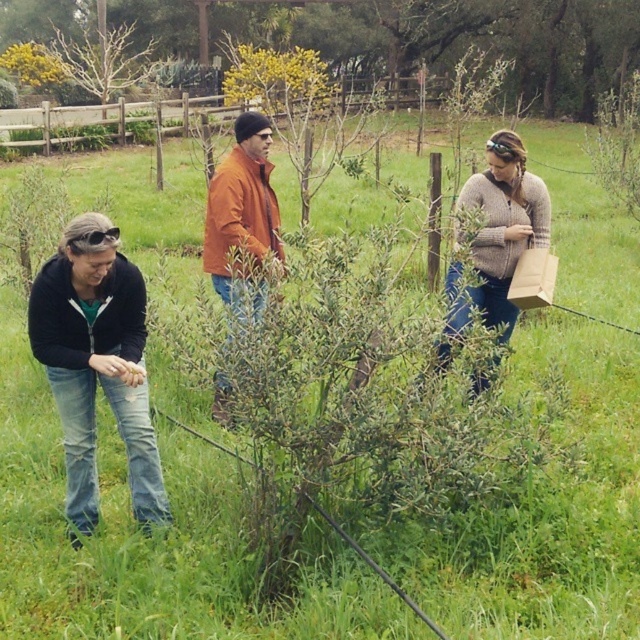
Question: Which of the following is the closest to the observer?

Choices:
 (A) (440, 349)
 (B) (42, 276)
 (C) (182, 12)
 (D) (209, 218)

Answer: (B)

Question: Does green leafy bush at center have a smaller size compared to matte black goggles at lower left?

Choices:
 (A) yes
 (B) no

Answer: (B)

Question: Which object is farther from the camera taking this photo?

Choices:
 (A) matte black goggles at lower left
 (B) denim jeans at lower left
 (C) knitted sweater at center
 (D) orange leather jacket at center

Answer: (B)

Question: Among these objects, which one is farthest from the camera?

Choices:
 (A) knitted sweater at center
 (B) matte black goggles at lower left
 (C) denim jeans at lower left

Answer: (C)

Question: Is knitted sweater at center positioned at the back of matte black goggles at lower left?

Choices:
 (A) yes
 (B) no

Answer: (B)

Question: From the image, what is the correct spatial relationship of denim jeans at lower left in relation to matte black goggles at lower left?

Choices:
 (A) below
 (B) above

Answer: (A)